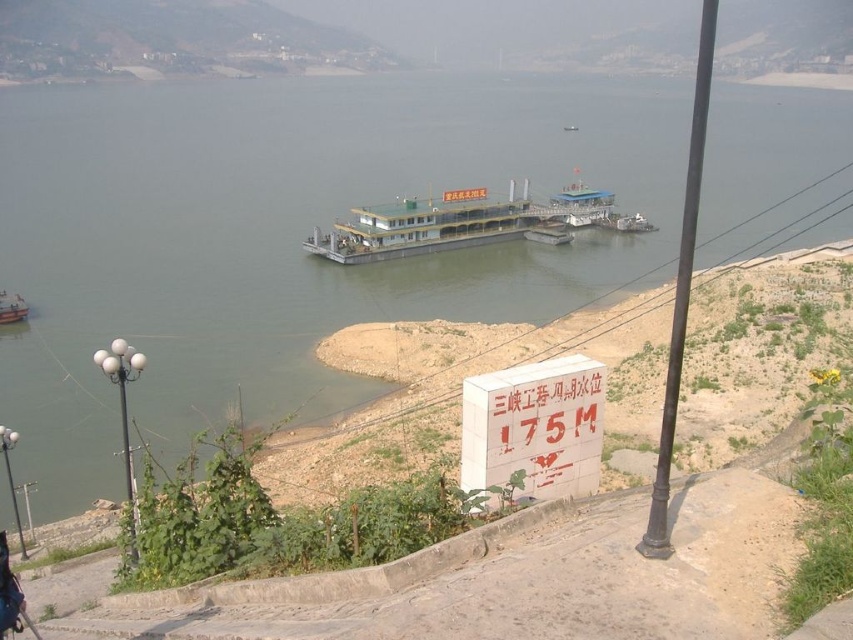
Question: Among these objects, which one is farthest from the camera?

Choices:
 (A) orange plastic boat at lower left
 (B) white concrete sign at lower center

Answer: (A)

Question: Which is nearer to the green metallic ferry at center?

Choices:
 (A) white concrete sign at lower center
 (B) orange plastic boat at lower left

Answer: (A)

Question: Is white concrete sign at lower center below orange plastic boat at lower left?

Choices:
 (A) no
 (B) yes

Answer: (B)

Question: Estimate the real-world distances between objects in this image. Which object is closer to the white concrete sign at lower center?

Choices:
 (A) green metallic ferry at center
 (B) orange plastic boat at lower left

Answer: (B)

Question: Does green metallic ferry at center have a smaller size compared to orange plastic boat at lower left?

Choices:
 (A) yes
 (B) no

Answer: (B)

Question: Is green metallic ferry at center to the right of orange plastic boat at lower left from the viewer's perspective?

Choices:
 (A) no
 (B) yes

Answer: (B)